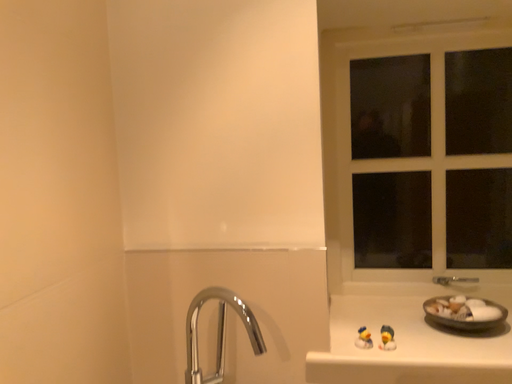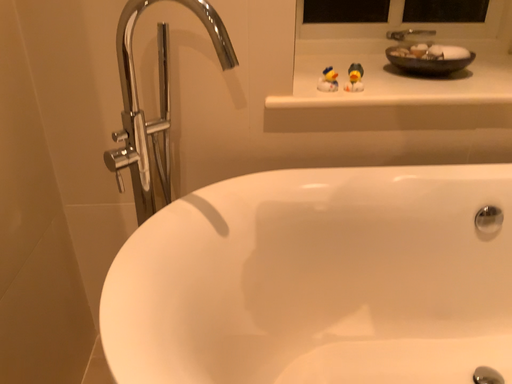
Question: How did the camera likely rotate when shooting the video?

Choices:
 (A) rotated left
 (B) rotated right

Answer: (B)